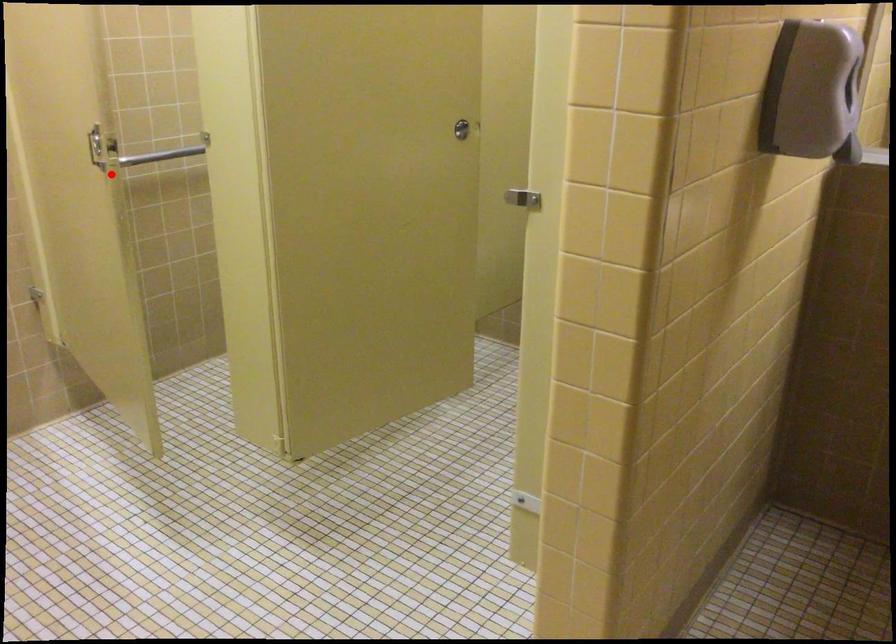
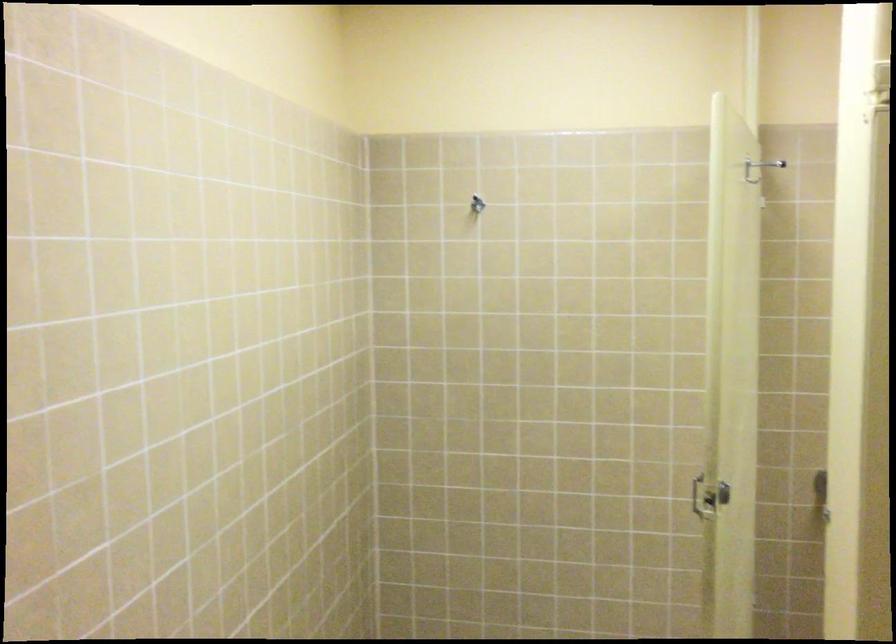
The point at the highlighted location is marked in the first image. Where is the corresponding point in the second image?

(708, 497)